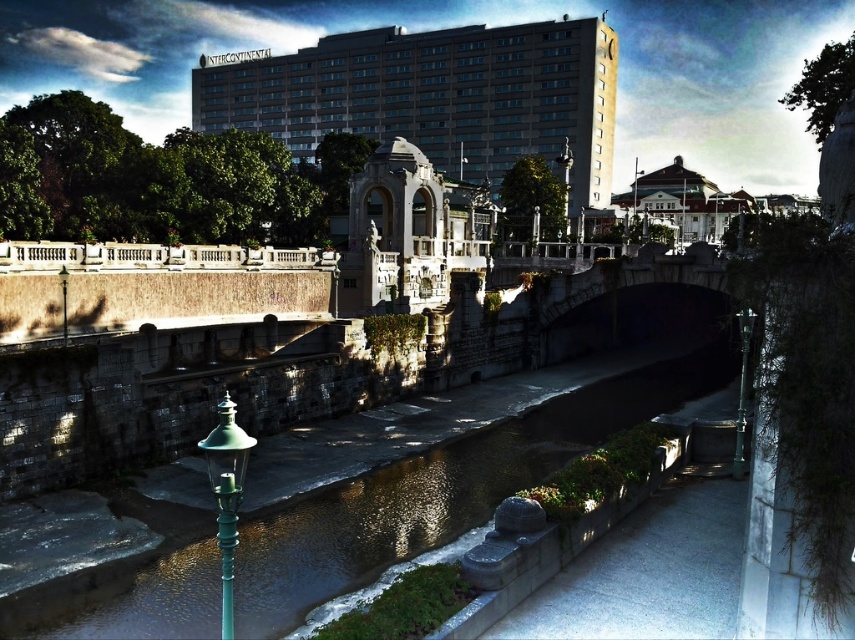
You are a tourist standing at the point marked as point (434, 97) in the image. What structure is directly in front of you?

The blue glass building at upper center is directly in front of you at point (434, 97).